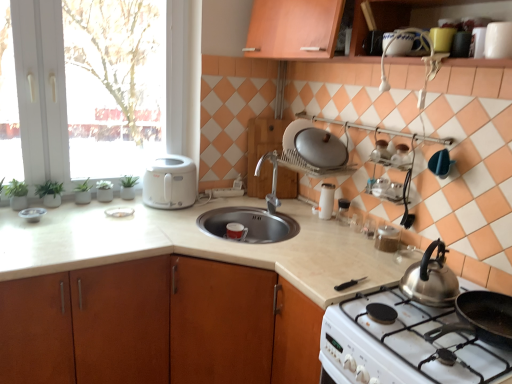
Find the location of a particular element. The width and height of the screenshot is (512, 384). empty space that is in between green matte plant at left and metallic silver bowl at left, the third appliance in the back-to-front sequence is located at coordinates (42, 207).